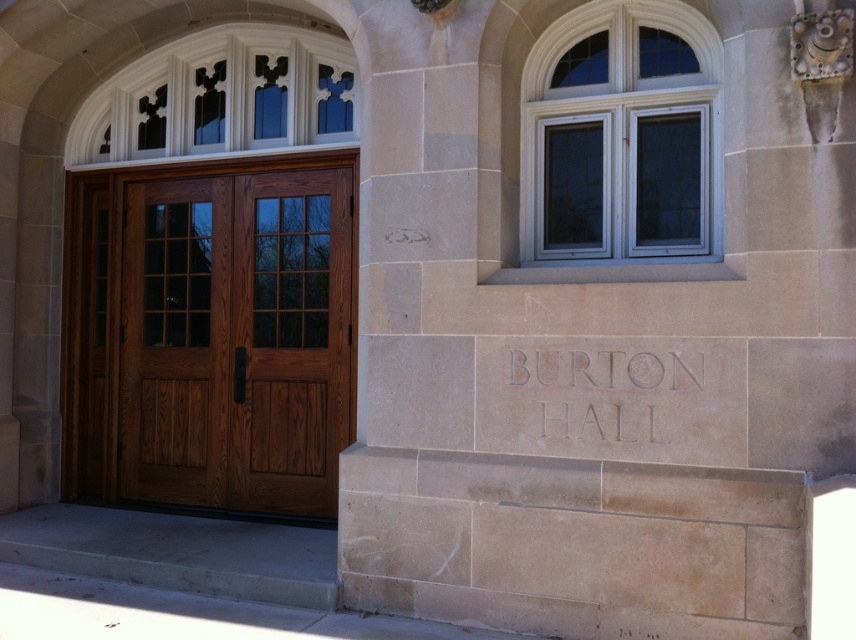
Does beige stone pillar at center come behind mahogany wood door at center?

No, beige stone pillar at center is in front of mahogany wood door at center.

Can you confirm if beige stone pillar at center is positioned below mahogany wood door at center?

No.

I want to click on beige stone pillar at center, so click(599, 310).

Between point (512, 17) and point (688, 385), which one is positioned behind?

Point (512, 17)

Does beige stone pillar at center come behind carved stone sign at center?

No, beige stone pillar at center is in front of carved stone sign at center.

Locate an element on the screen. The image size is (856, 640). beige stone pillar at center is located at coordinates (599, 310).

This screenshot has height=640, width=856. I want to click on mahogany wood door at center, so click(x=209, y=333).

Does mahogany wood door at center have a greater width compared to carved stone sign at center?

Yes.

Find the location of `mahogany wood door at center`. mahogany wood door at center is located at coordinates (209, 333).